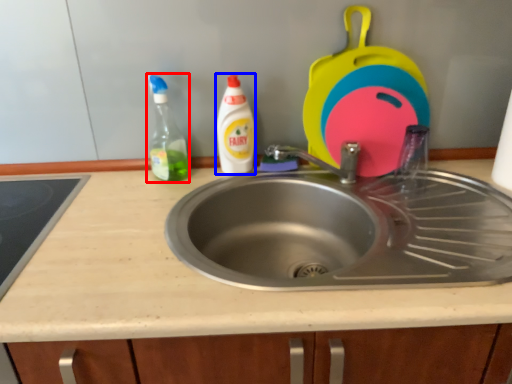
Question: Which object is further to the camera taking this photo, cleaning product (highlighted by a red box) or cleaning product (highlighted by a blue box)?

Choices:
 (A) cleaning product
 (B) cleaning product

Answer: (B)